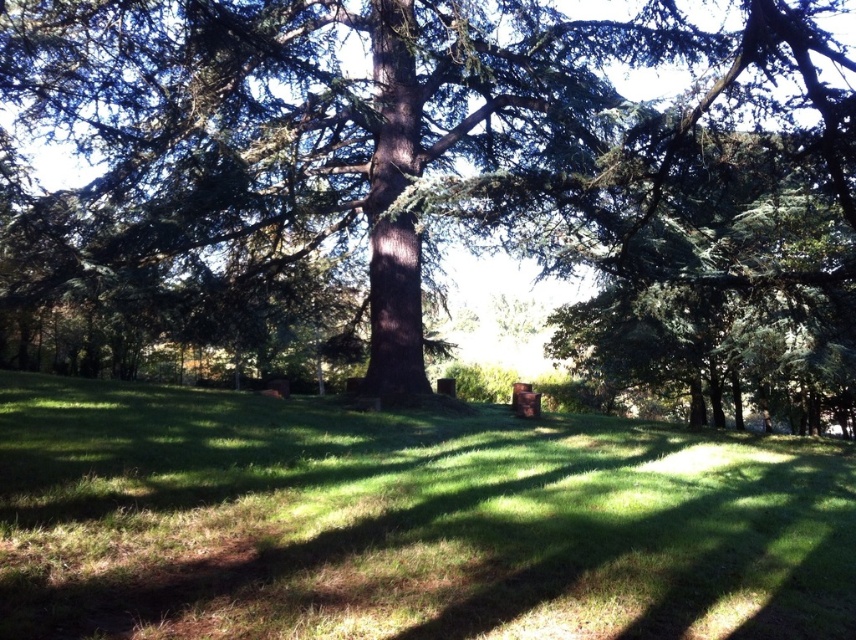
You are a gardener standing in the middle of the scene. You need to place a small statue exactly between the green textured tree at center and the green grassy at center. Since both are at the center, how do you decide where to place the statue?

The green textured tree at center is taller than the green grassy at center, so the statue should be placed closer to the base of the green textured tree at center to ensure it is centered between their vertical positions.

You are standing in the middle of the scene and want to walk towards the green grassy at center. Which direction should you move relative to the green textured tree at center?

To reach the green grassy at center, you should move to the right side of the green textured tree at center since the tree is positioned on the left side of the grassy area.

You are standing at the point marked by point (444, 179) in the image. What object are you directly facing?

The point (444, 179) marks the green textured tree at center, so you are directly facing the green textured tree at center.